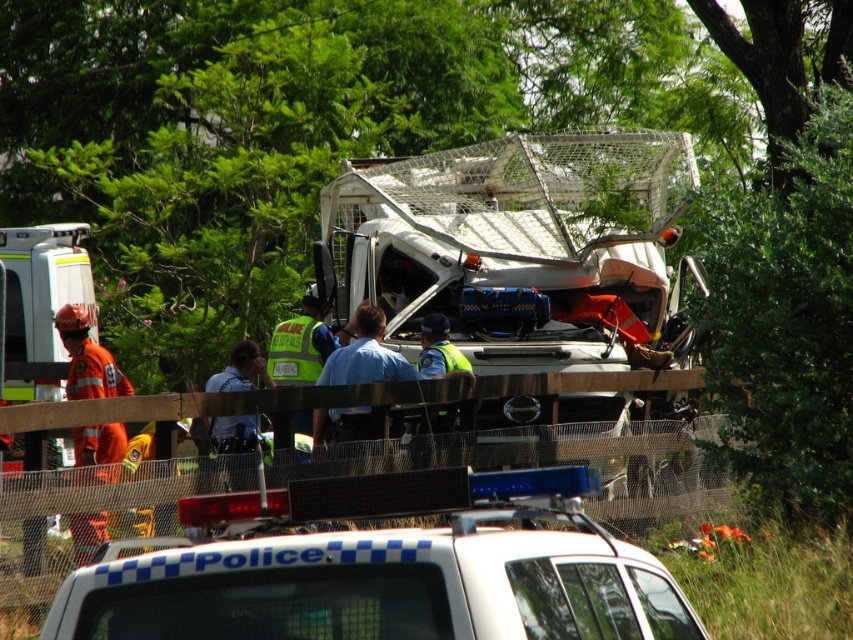
Does white plastic police car at center have a smaller size compared to reflective yellow vest at center?

Actually, white plastic police car at center might be larger than reflective yellow vest at center.

You are a GUI agent. You are given a task and a screenshot of the screen. Output one action in this format:
    pyautogui.click(x=<x>, y=<y>)
    Task: Click on the white plastic police car at center
    
    Given the screenshot: What is the action you would take?
    pyautogui.click(x=381, y=566)

Is point (602, 634) positioned in front of point (242, 355)?

Yes, point (602, 634) is in front of point (242, 355).

At what (x,y) coordinates should I click in order to perform the action: click on white plastic police car at center. Please return your answer as a coordinate pair (x, y). Image resolution: width=853 pixels, height=640 pixels. Looking at the image, I should click on (381, 566).

Is white plastic police car at center to the right of orange reflective uniform at left from the viewer's perspective?

Indeed, white plastic police car at center is positioned on the right side of orange reflective uniform at left.

Which is behind, point (212, 632) or point (80, 538)?

Point (80, 538)

Is point (399, 513) closer to viewer compared to point (70, 305)?

Yes, point (399, 513) is in front of point (70, 305).

Locate an element on the screen. This screenshot has width=853, height=640. white plastic police car at center is located at coordinates (381, 566).

Who is positioned more to the left, orange reflective uniform at left or reflective yellow vest at center?

orange reflective uniform at left

Describe the element at coordinates (86, 358) in the screenshot. I see `orange reflective uniform at left` at that location.

This screenshot has width=853, height=640. Identify the location of orange reflective uniform at left. (86, 358).